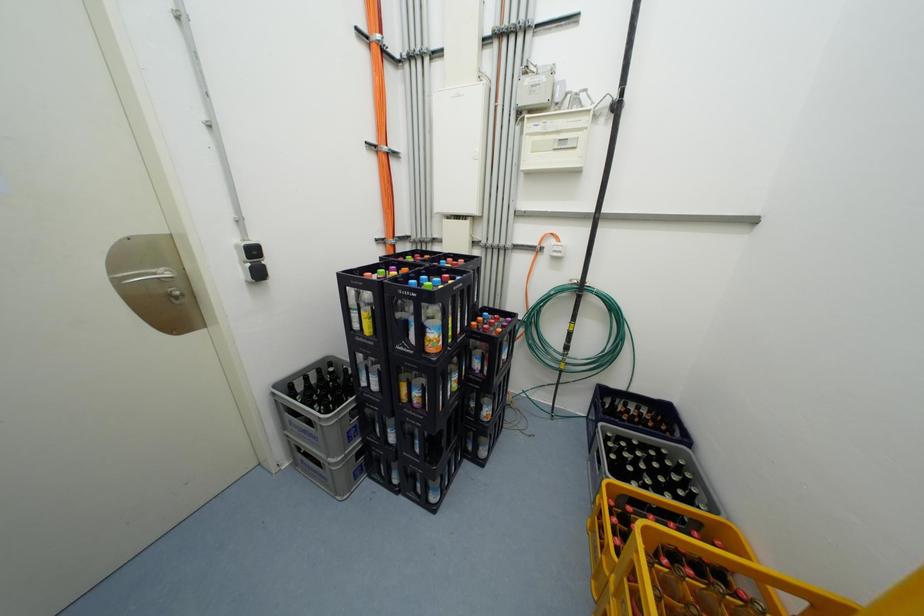
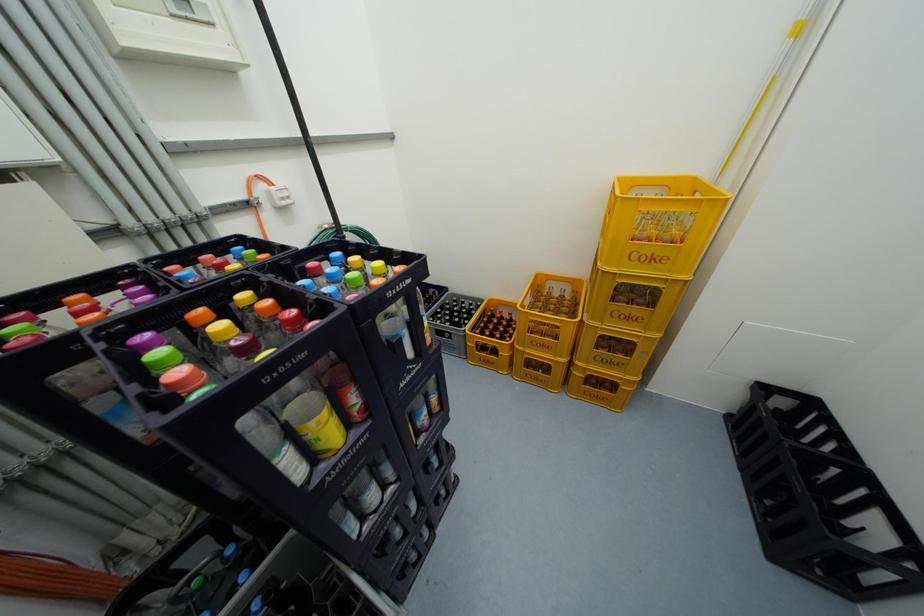
First-person continuous shooting, in which direction is the camera rotating?

The rotation direction of the camera is right-down.